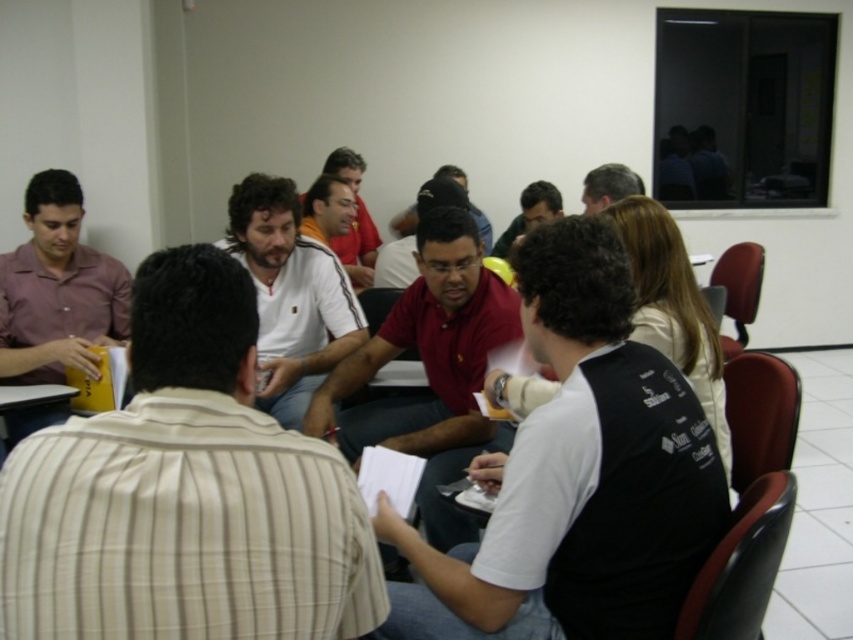
You are a photographer trying to capture a group photo of the white matte shirt at center and the matte red shirt at center. You need to ensure that both shirts are visible in the frame. Given that the camera has a fixed focal length, which shirt should you focus on to ensure the wider shirt is properly in focus?

The white matte shirt at center has a greater width than the matte red shirt at center. To ensure the wider shirt is properly in focus, you should focus on the white matte shirt at center.

You are a photographer standing in front of the group. You want to take a photo of the white cotton shirt at center and the matte black shirt at center. Which shirt will appear larger in the photo?

The white cotton shirt at center will appear larger in the photo because it is closer to the viewer than the matte black shirt at center.

You are standing in the meeting room and see two points on the table. The first point is at coordinate point(323, 461) and the second is at point(601, 193). Which point is closer to you?

Point(323, 461) is in front of point(601, 193), so it is closer to you.